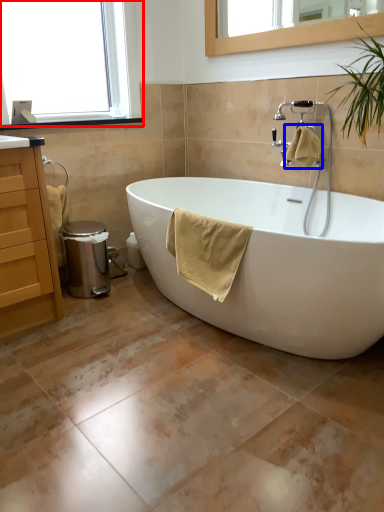
Question: Which point is further to the camera, window (highlighted by a red box) or bath towel (highlighted by a blue box)?

Choices:
 (A) window
 (B) bath towel

Answer: (B)